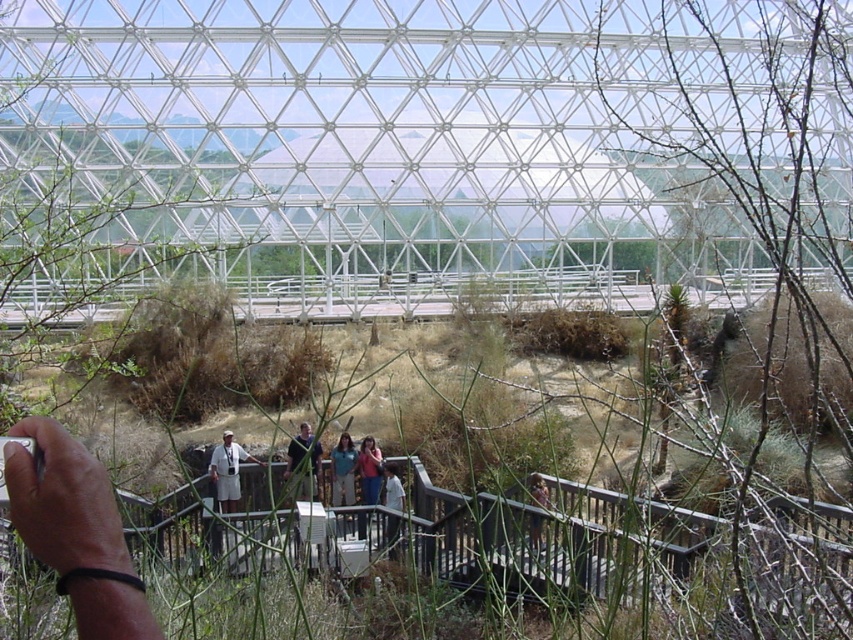
You are standing at the entrance of the geodesic dome and see the blue denim jeans at center. If you walk directly towards the jeans, will you first encounter the wooden walkway or the dry grasses?

The blue denim jeans at center is located at point [343,470]. Since the jeans are at the center of the dome, which is likely surrounded by the wooden walkway, you would first encounter the wooden walkway before reaching the jeans.

You are standing at point A with coordinates point A at (354,465). You want to walk to point B at 0.325, 0.674. The wooden walkway has a width of 2 meters. Can you walk straight from point A to point B without leaving the walkway?

The distance between point A at (354,465) and point B at 0.325, 0.674 is 19.60 meters. Since the walkway is 2 meters wide, you can walk straight from point A to point B without leaving the walkway as the walkway provides sufficient width for the journey.